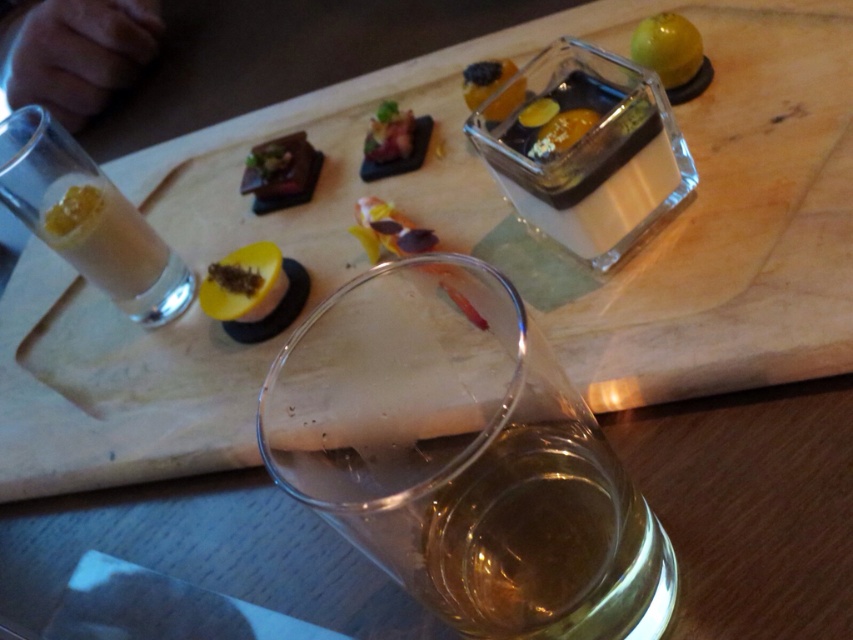
What are the coordinates of the matte brown tart at upper left on the wooden serving board?

The matte brown tart at upper left is located at coordinates point (281, 172).

You are at the center of the table. Where is the translucent glass cube at upper center located relative to you?

The translucent glass cube at upper center is located at point (485,80) relative to the center of the table.

From the picture: You are a food stylist arranging items on a wooden board. You need to ensure that the translucent glass at center and the matte brown tart at upper left are visible to guests seated at both ends of the table. Considering their heights, which item might block the view of the other when viewed from across the table?

The translucent glass at center is taller than the matte brown tart at upper left, so it might block the view of the tart from across the table.